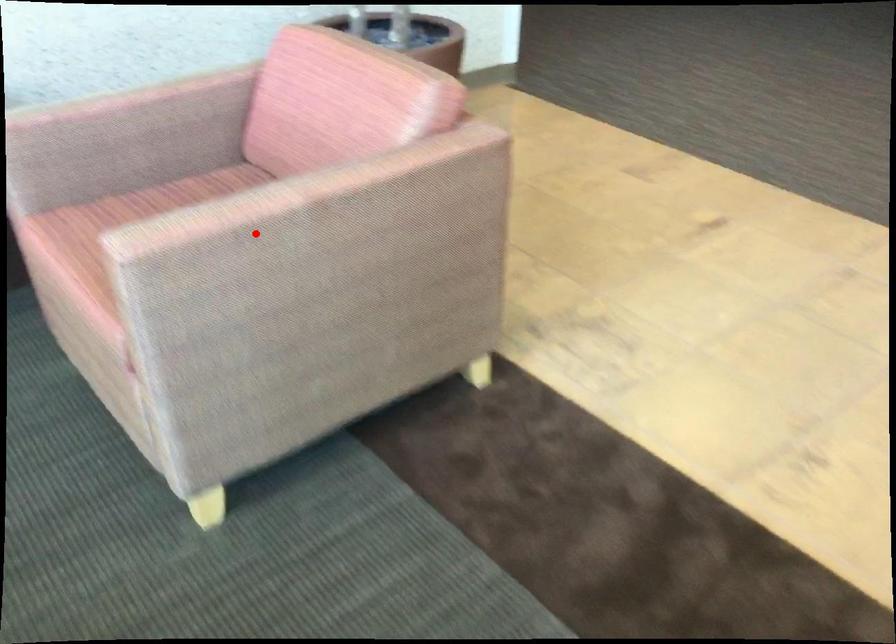
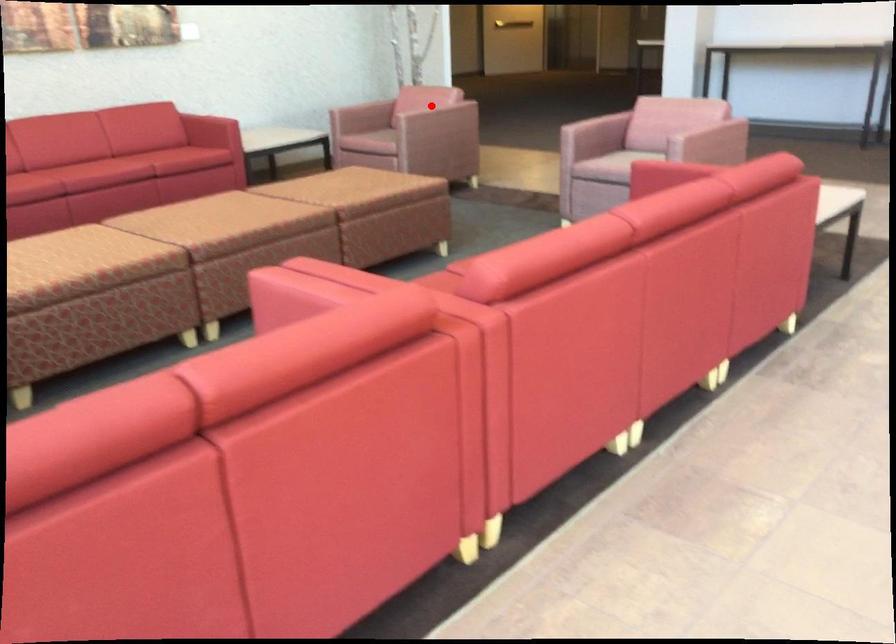
I am providing you with two images of the same scene from different viewpoints. A red point is marked on the first image and another point is marked on the second image. Are the points marked in image1 and image2 representing the same 3D position?

Yes